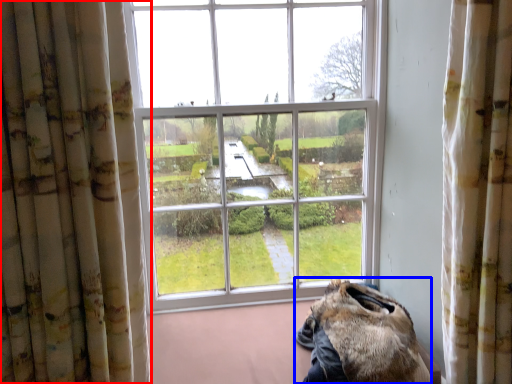
Question: Which object appears farthest to the camera in this image, curtain (highlighted by a red box) or animal (highlighted by a blue box)?

Choices:
 (A) curtain
 (B) animal

Answer: (B)